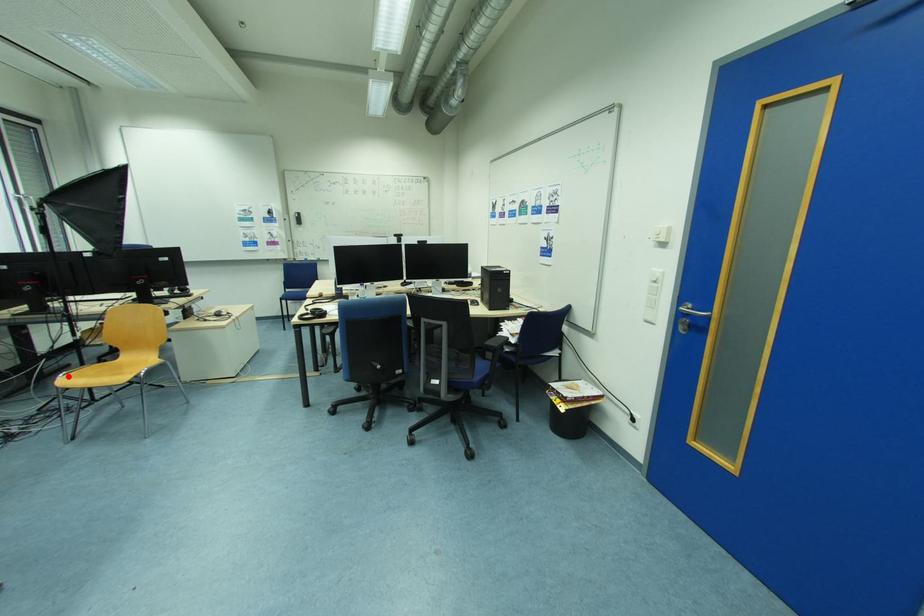
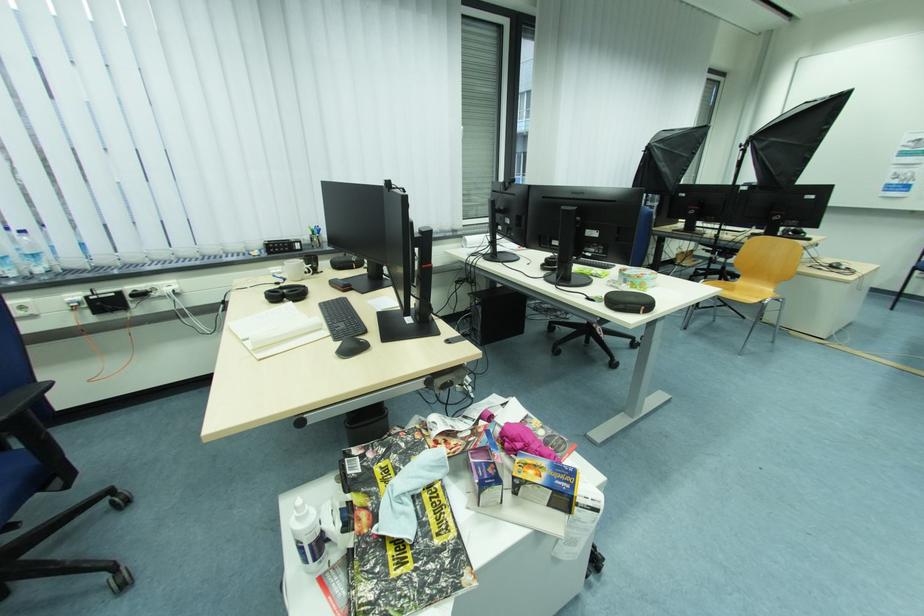
Question: I am providing you with two images of the same scene from different viewpoints. A red point is shown in image1. For the corresponding object point in image2, is it positioned nearer or farther from the camera?

Choices:
 (A) Nearer
 (B) Farther

Answer: (A)